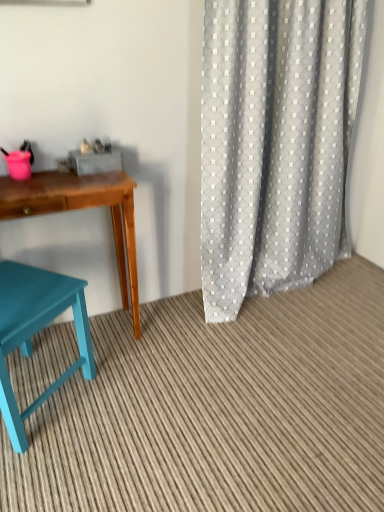
What do you see at coordinates (275, 143) in the screenshot?
I see `gray textured curtain at right` at bounding box center [275, 143].

In order to face teal wood stool at lower left, should I rotate leftwards or rightwards?

Turn right approximately 10.673 degrees to face it.

This screenshot has height=512, width=384. What do you see at coordinates (82, 208) in the screenshot? I see `teal wood desk at left` at bounding box center [82, 208].

What are the coordinates of `teal painted wood chair at lower left` in the screenshot? It's located at (36, 331).

In order to click on gray textured curtain at right in this screenshot , I will do `click(275, 143)`.

Would you say gray textured curtain at right is outside teal painted wood chair at lower left?

That's correct, gray textured curtain at right is outside of teal painted wood chair at lower left.

Does gray textured curtain at right have a smaller size compared to teal painted wood chair at lower left?

Actually, gray textured curtain at right might be larger than teal painted wood chair at lower left.

From a real-world perspective, is gray textured curtain at right under teal painted wood chair at lower left?

No, from a real-world perspective, gray textured curtain at right is not below teal painted wood chair at lower left.

Which object is positioned more to the right, teal wood stool at lower left or teal painted wood chair at lower left?

teal wood stool at lower left is more to the right.

Is teal wood stool at lower left positioned in front of teal painted wood chair at lower left?

Yes, the depth of teal wood stool at lower left is less than that of teal painted wood chair at lower left.

Is point (150, 429) in front of point (39, 280)?

Yes, it is.

Based on the photo, between teal wood stool at lower left and teal painted wood chair at lower left, which one has smaller size?

teal wood stool at lower left.

Is teal painted wood chair at lower left aimed at teal wood stool at lower left?

No, teal painted wood chair at lower left does not turn towards teal wood stool at lower left.

Locate an element on the screen. plain to the right of teal painted wood chair at lower left is located at coordinates (219, 410).

Based on their positions, is teal painted wood chair at lower left located to the left or right of teal wood stool at lower left?

From the image, it's evident that teal painted wood chair at lower left is to the left of teal wood stool at lower left.

Is teal wood desk at left touching gray textured curtain at right?

They are not placed beside each other.

Which object is positioned more to the left, teal wood desk at left or gray textured curtain at right?

From the viewer's perspective, teal wood desk at left appears more on the left side.

From a real-world perspective, is teal wood desk at left on top of gray textured curtain at right?

No.

Which object is more forward, gray textured curtain at right or teal wood desk at left?

gray textured curtain at right.

Considering the points (227, 298) and (91, 194), which point is behind, point (227, 298) or point (91, 194)?

The point (227, 298) is farther from the camera.

Is gray textured curtain at right to the left of teal wood desk at left from the viewer's perspective?

Incorrect, gray textured curtain at right is not on the left side of teal wood desk at left.

Looking at this image, is teal painted wood chair at lower left far away from teal wood desk at left?

No, teal painted wood chair at lower left is not far away from teal wood desk at left.

Which is more to the right, teal painted wood chair at lower left or teal wood desk at left?

From the viewer's perspective, teal wood desk at left appears more on the right side.

Is teal painted wood chair at lower left facing away from teal wood desk at left?

Yes, teal wood desk at left is at the back of teal painted wood chair at lower left.

Which object is further away from the camera, teal painted wood chair at lower left or teal wood desk at left?

teal wood desk at left is behind.

Is teal wood stool at lower left behind teal wood desk at left?

No, it is in front of teal wood desk at left.

Is teal wood desk at left at the back of teal wood stool at lower left?

No, teal wood desk at left is not at the back of teal wood stool at lower left.

From the image's perspective, is teal wood stool at lower left located above or below teal wood desk at left?

teal wood stool at lower left is below teal wood desk at left.

Looking at this image, looking at their sizes, would you say teal wood stool at lower left is wider or thinner than teal wood desk at left?

Clearly, teal wood stool at lower left has more width compared to teal wood desk at left.

You are a GUI agent. You are given a task and a screenshot of the screen. Output one action in this format:
    pyautogui.click(x=<x>, y=<y>)
    Task: Click on the curtain behind the teal painted wood chair at lower left
    The image size is (384, 512).
    Given the screenshot: What is the action you would take?
    pyautogui.click(x=275, y=143)

You are a GUI agent. You are given a task and a screenshot of the screen. Output one action in this format:
    pyautogui.click(x=<x>, y=<y>)
    Task: Click on the plain that is in front of the teal painted wood chair at lower left
    The width and height of the screenshot is (384, 512).
    Given the screenshot: What is the action you would take?
    pyautogui.click(x=219, y=410)

Based on their spatial positions, is teal wood stool at lower left or gray textured curtain at right further from teal wood desk at left?

gray textured curtain at right is positioned further to the anchor teal wood desk at left.

Looking at the image, which one is located closer to teal painted wood chair at lower left, teal wood desk at left or teal wood stool at lower left?

The object closer to teal painted wood chair at lower left is teal wood desk at left.

Which object lies further to the anchor point teal wood stool at lower left, teal wood desk at left or teal painted wood chair at lower left?

teal wood desk at left lies further to teal wood stool at lower left than the other object.

Consider the image. Which object lies further to the anchor point teal wood stool at lower left, teal painted wood chair at lower left or teal wood desk at left?

Among the two, teal wood desk at left is located further to teal wood stool at lower left.

Which object lies nearer to the anchor point teal wood desk at left, gray textured curtain at right or teal wood stool at lower left?

The object closer to teal wood desk at left is teal wood stool at lower left.

Which object lies further to the anchor point gray textured curtain at right, teal wood desk at left or teal wood stool at lower left?

The object further to gray textured curtain at right is teal wood stool at lower left.

When comparing their distances from gray textured curtain at right, does teal wood desk at left or teal painted wood chair at lower left seem further?

The object further to gray textured curtain at right is teal painted wood chair at lower left.

Considering their positions, is teal painted wood chair at lower left positioned further to gray textured curtain at right than teal wood stool at lower left?

teal painted wood chair at lower left is further to gray textured curtain at right.

You are a GUI agent. You are given a task and a screenshot of the screen. Output one action in this format:
    pyautogui.click(x=<x>, y=<y>)
    Task: Click on the desk between teal painted wood chair at lower left and gray textured curtain at right
    
    Given the screenshot: What is the action you would take?
    pyautogui.click(x=82, y=208)

Find the location of a particular element. plain between teal wood desk at left and gray textured curtain at right is located at coordinates (219, 410).

You are a GUI agent. You are given a task and a screenshot of the screen. Output one action in this format:
    pyautogui.click(x=<x>, y=<y>)
    Task: Click on the plain between teal painted wood chair at lower left and gray textured curtain at right in the horizontal direction
    The image size is (384, 512).
    Given the screenshot: What is the action you would take?
    pyautogui.click(x=219, y=410)

What are the coordinates of `desk between teal painted wood chair at lower left and teal wood stool at lower left from left to right` in the screenshot? It's located at (82, 208).